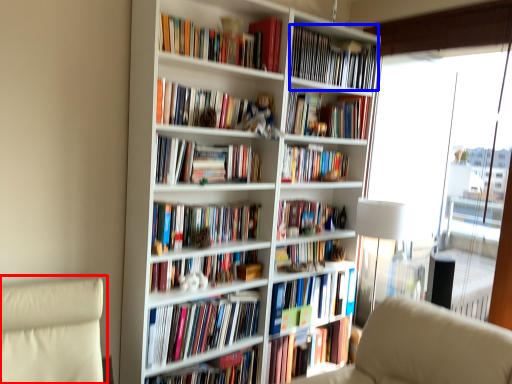
Question: Which object is closer to the camera taking this photo, swivel chair (highlighted by a red box) or book (highlighted by a blue box)?

Choices:
 (A) swivel chair
 (B) book

Answer: (A)